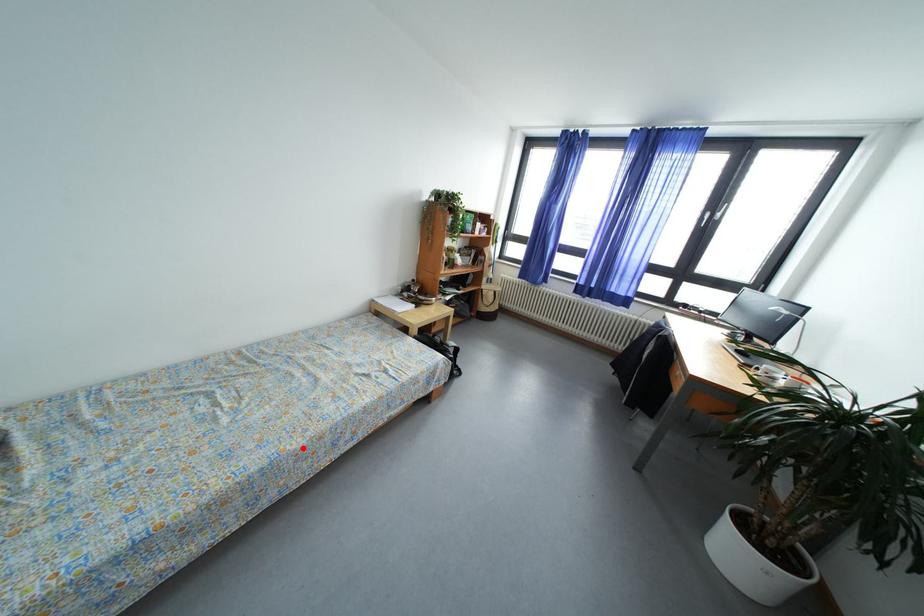
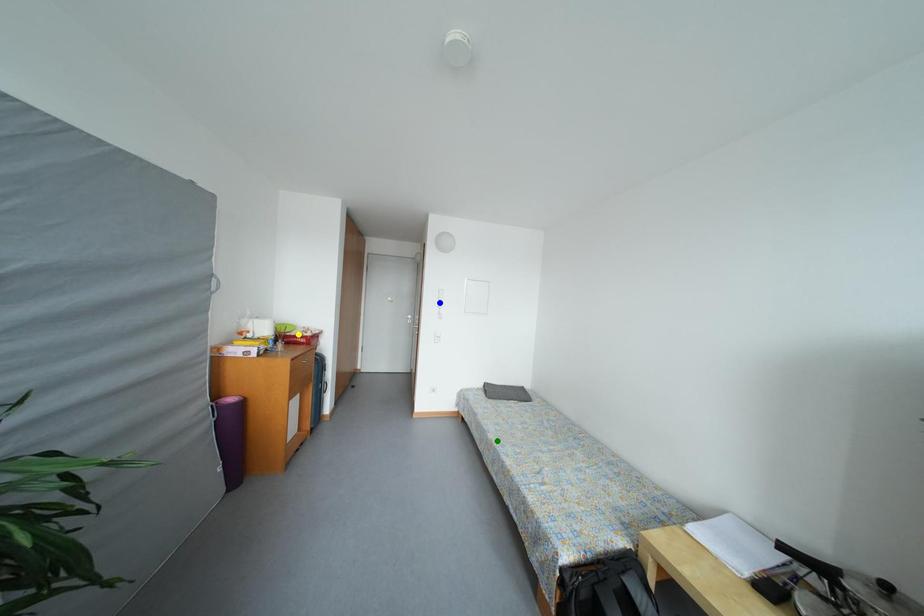
Question: I am providing you with two images of the same scene from different viewpoints. A red point is marked on the first image. You are given multiple points on the second image. Which mark in image 2 goes with the point in image 1?

Choices:
 (A) green point
 (B) blue point
 (C) yellow point

Answer: (A)